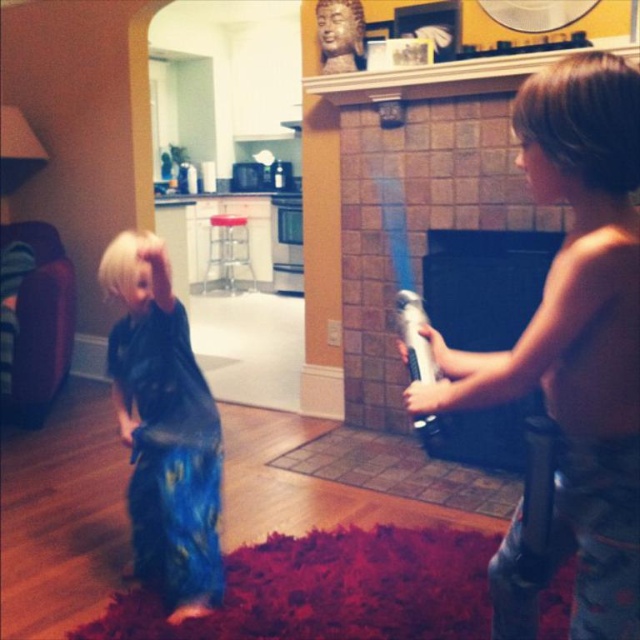
Between shiny metallic toy at right and blue sequined skirt at lower left, which one appears on the left side from the viewer's perspective?

blue sequined skirt at lower left is more to the left.

Who is lower down, shiny metallic toy at right or blue sequined skirt at lower left?

Positioned lower is blue sequined skirt at lower left.

Between point (582, 497) and point (166, 524), which one is positioned behind?

The point (166, 524) is behind.

I want to click on shiny metallic toy at right, so click(x=577, y=328).

Which is in front, point (426, 264) or point (412, 301)?

Positioned in front is point (412, 301).

Who is positioned more to the left, black brick fireplace at center or transparent plastic water gun at right?

Positioned to the left is transparent plastic water gun at right.

Which is in front, point (525, 250) or point (424, 344)?

Positioned in front is point (424, 344).

The width and height of the screenshot is (640, 640). Identify the location of black brick fireplace at center. pyautogui.click(x=484, y=284).

Who is positioned more to the left, blue sequined skirt at lower left or transparent plastic water gun at right?

Positioned to the left is blue sequined skirt at lower left.

Between point (134, 262) and point (412, 301), which one is positioned behind?

The point (134, 262) is more distant.

The height and width of the screenshot is (640, 640). Find the location of `blue sequined skirt at lower left`. blue sequined skirt at lower left is located at coordinates (x=164, y=429).